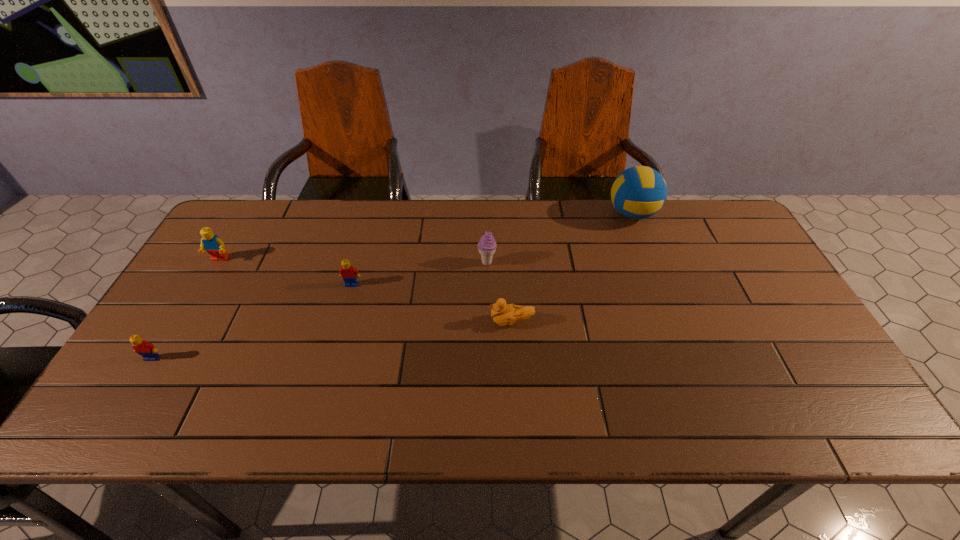
At what (x,y) coordinates should I click in order to perform the action: click on the farthest object. Please return your answer as a coordinate pair (x, y). This screenshot has width=960, height=540. Looking at the image, I should click on (639, 192).

Where is `the tallest object`? This screenshot has width=960, height=540. the tallest object is located at coordinates (639, 192).

This screenshot has height=540, width=960. In order to click on icecream in this screenshot , I will do `click(487, 245)`.

Where is `the tallest Lego`? the tallest Lego is located at coordinates (213, 245).

The width and height of the screenshot is (960, 540). Find the location of `the third object from left to right`. the third object from left to right is located at coordinates (349, 274).

You are a GUI agent. You are given a task and a screenshot of the screen. Output one action in this format:
    pyautogui.click(x=<x>, y=<y>)
    Task: Click on the second nearest Lego
    The height and width of the screenshot is (540, 960).
    Given the screenshot: What is the action you would take?
    pyautogui.click(x=349, y=274)

At what (x,y) coordinates should I click in order to perform the action: click on duckling. Please return your answer as a coordinate pair (x, y). This screenshot has height=540, width=960. Looking at the image, I should click on (503, 314).

At what (x,y) coordinates should I click in order to perform the action: click on the nearest object. Please return your answer as a coordinate pair (x, y). Looking at the image, I should click on (147, 350).

Identify the location of vacant space located on the front of the rightmost object. This screenshot has height=540, width=960. (658, 280).

The width and height of the screenshot is (960, 540). What are the coordinates of `vacant space located 0.370m on the right of the icecream` in the screenshot? It's located at (621, 262).